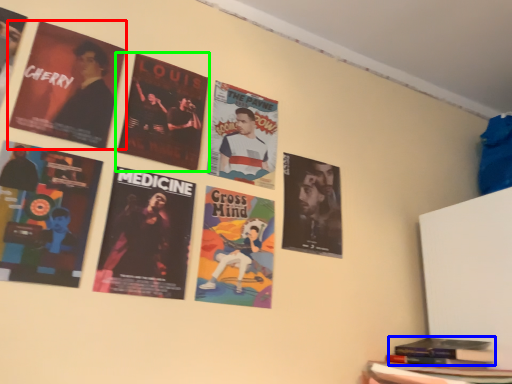
Question: Estimate the real-world distances between objects in this image. Which object is closer to poster (highlighted by a red box), book (highlighted by a blue box) or poster (highlighted by a green box)?

Choices:
 (A) book
 (B) poster

Answer: (B)